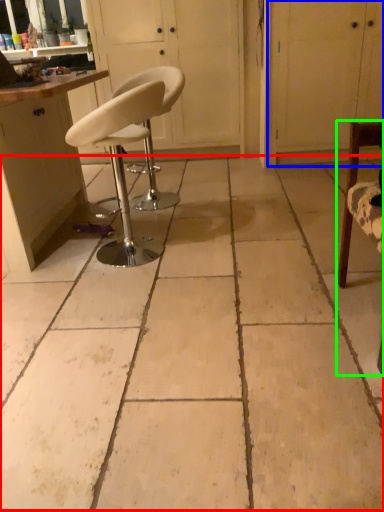
Question: Which object is the closest to the concrete (highlighted by a red box)? Choose among these: screen door (highlighted by a blue box) or chair (highlighted by a green box).

Choices:
 (A) screen door
 (B) chair

Answer: (B)